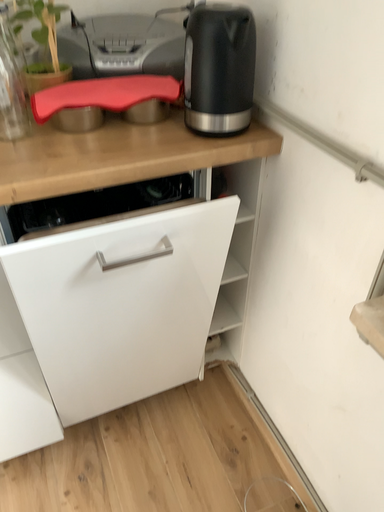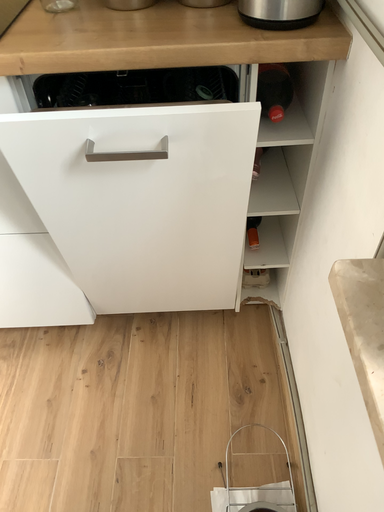
Question: How did the camera likely rotate when shooting the video?

Choices:
 (A) rotated upward
 (B) rotated downward

Answer: (B)